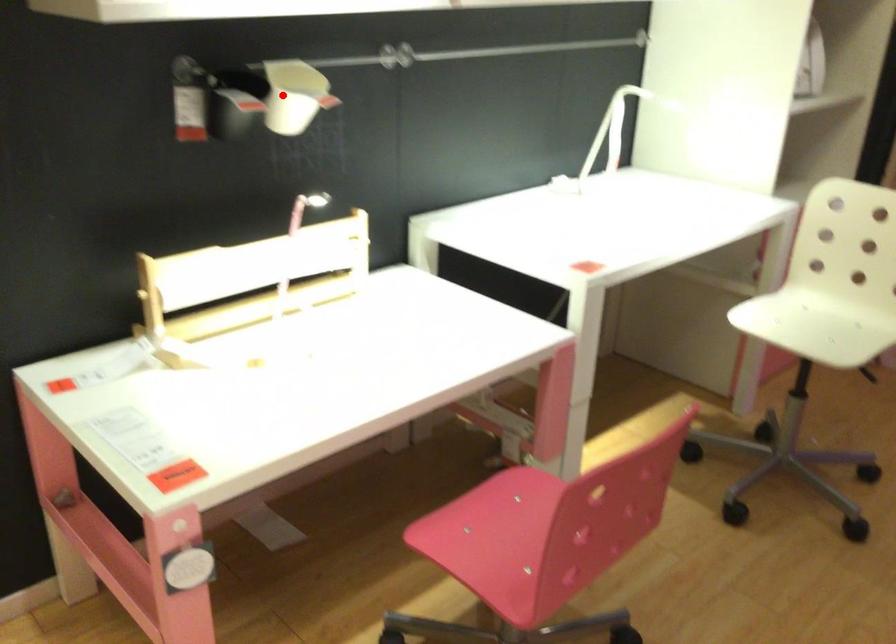
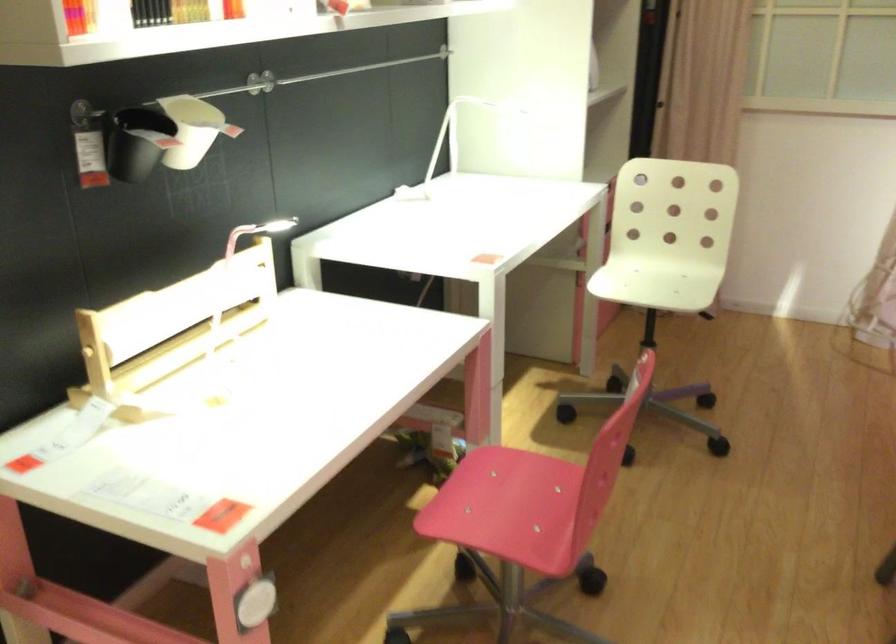
The point at the highlighted location is marked in the first image. Where is the corresponding point in the second image?

(193, 129)